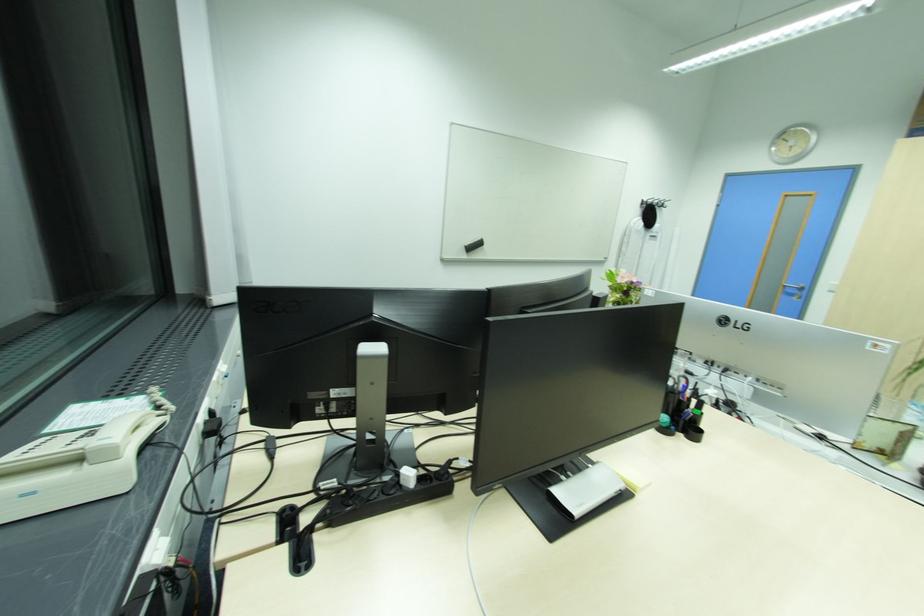
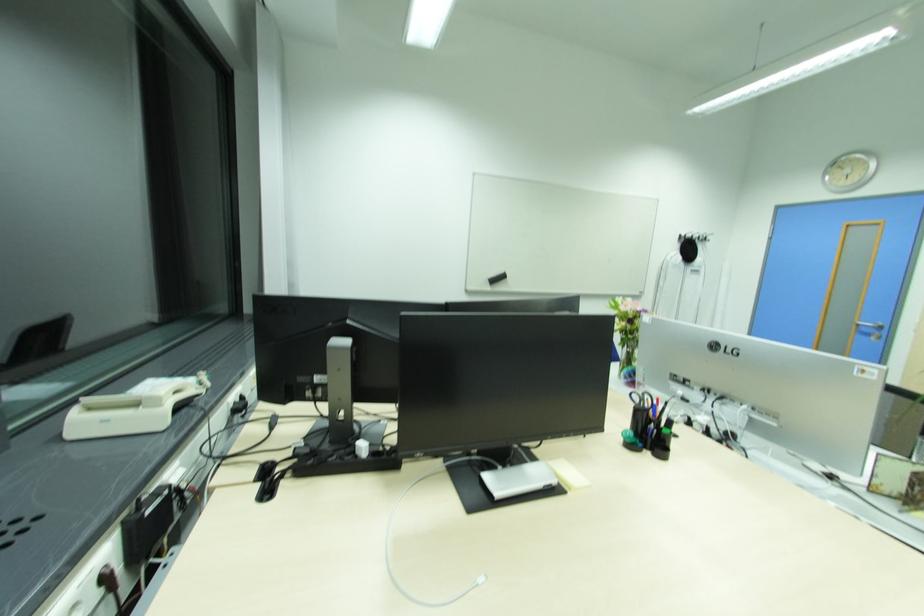
Find the pixel in the second image that matches (630,293) in the first image.

(637, 321)